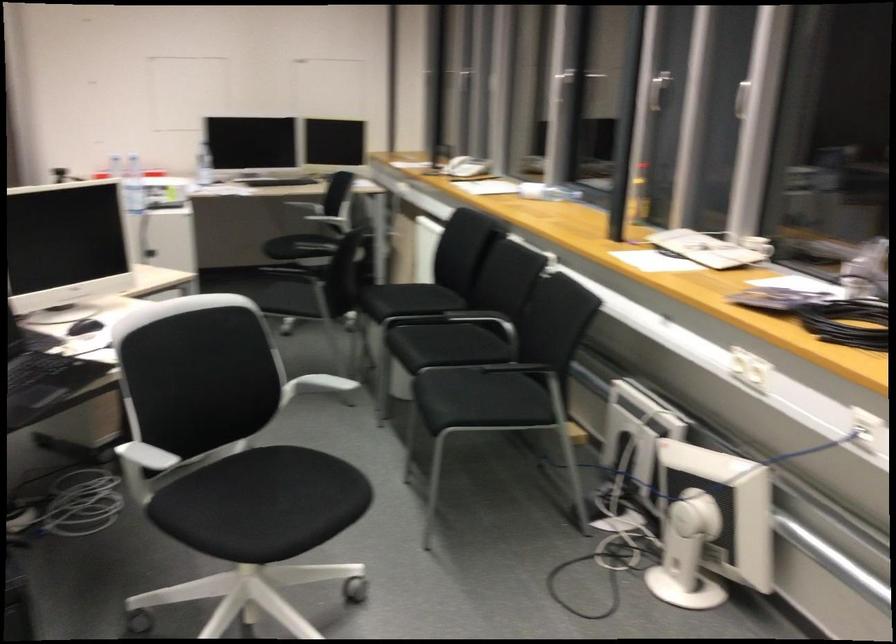
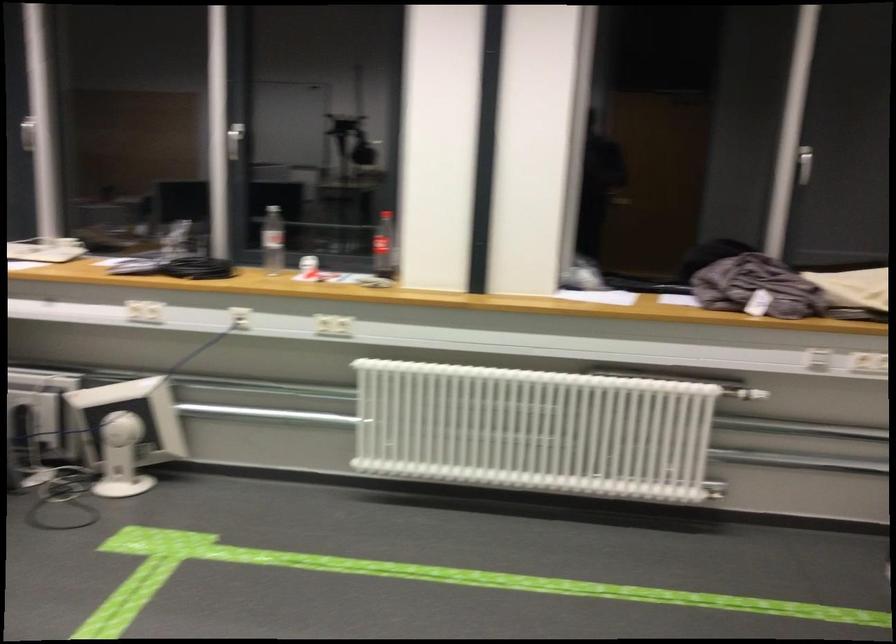
Where in the second image is the point corresponding to (x=730, y=73) from the first image?

(27, 134)